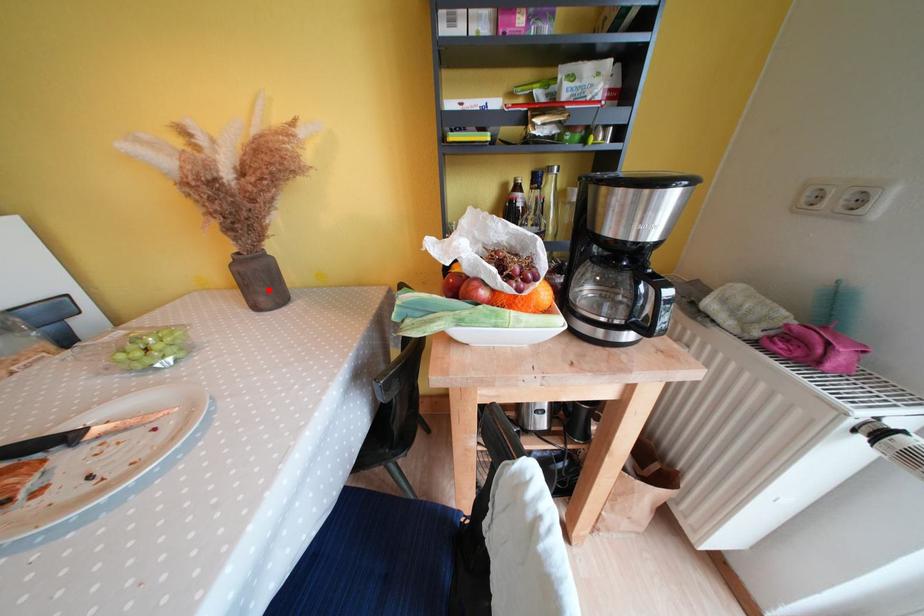
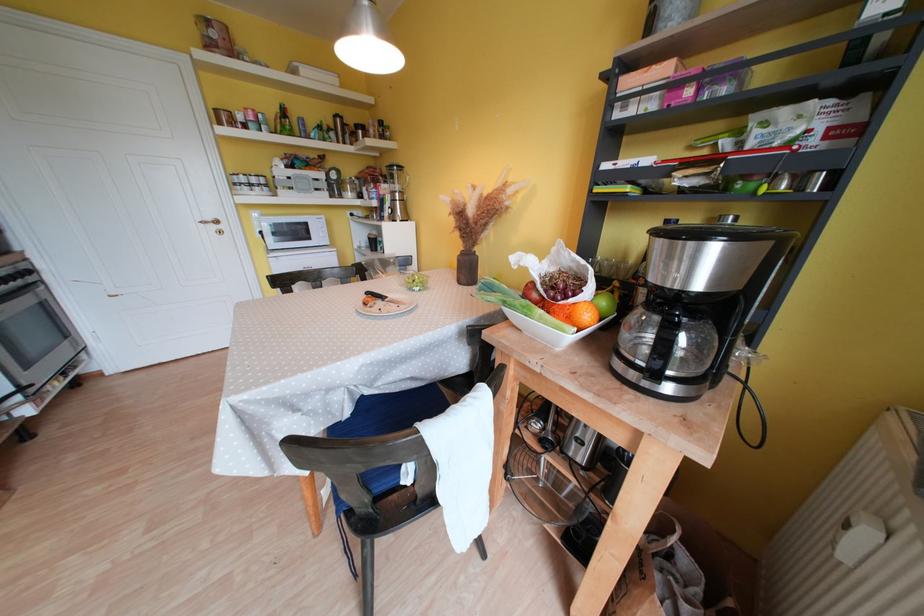
Locate, in the second image, the point that corresponds to the highlighted location in the first image.

(472, 275)